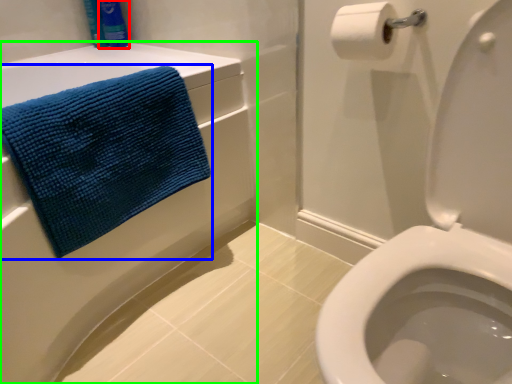
Question: Based on their relative distances, which object is farther from toiletry (highlighted by a red box)? Choose from towel (highlighted by a blue box) and bath (highlighted by a green box).

Choices:
 (A) towel
 (B) bath

Answer: (A)